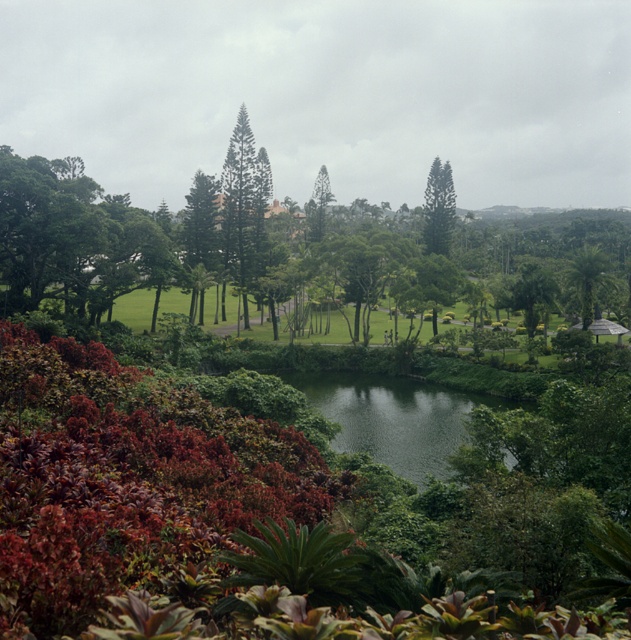
The image size is (631, 640). Describe the element at coordinates (244, 205) in the screenshot. I see `green textured pine tree at center` at that location.

Who is taller, green textured pine tree at center or green textured tree at center?

With more height is green textured pine tree at center.

You are a GUI agent. You are given a task and a screenshot of the screen. Output one action in this format:
    pyautogui.click(x=<x>, y=<y>)
    Task: Click on the green textured pine tree at center
    This screenshot has width=631, height=640.
    Given the screenshot: What is the action you would take?
    pyautogui.click(x=244, y=205)

Between point (432, 232) and point (591, 282), which one is positioned in front?

Point (591, 282) is more forward.

Consider the image. Is green textured pine tree at upper center smaller than green leafy palm at right?

Yes, green textured pine tree at upper center is smaller than green leafy palm at right.

Is point (442, 228) positioned in front of point (581, 292)?

That is False.

This screenshot has width=631, height=640. Find the location of `green textured pine tree at upper center`. green textured pine tree at upper center is located at coordinates click(439, 209).

Which is above, green leafy palm at right or green textured tree at center?

green textured tree at center is above.

Does point (604, 276) lie behind point (326, 172)?

No, (604, 276) is in front of (326, 172).

This screenshot has width=631, height=640. Identify the location of green leafy palm at right. (587, 278).